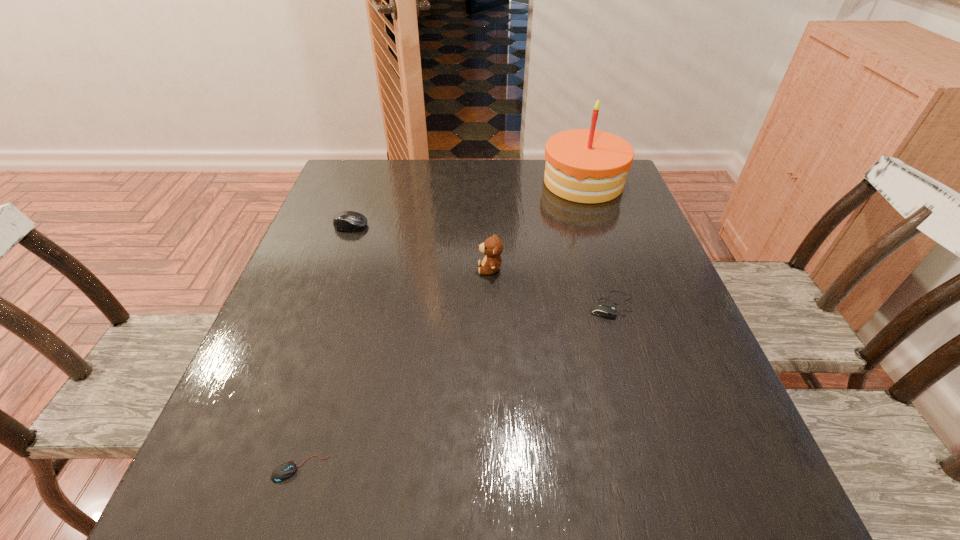
Where is `vacant space located on the left of the birthday cake`? This screenshot has width=960, height=540. vacant space located on the left of the birthday cake is located at coordinates (429, 182).

You are a GUI agent. You are given a task and a screenshot of the screen. Output one action in this format:
    pyautogui.click(x=<x>, y=<y>)
    Task: Click on the vacant space located 0.220m on the face of the teddy bear
    
    Given the screenshot: What is the action you would take?
    pyautogui.click(x=382, y=268)

Identify the location of vacant space located 0.360m on the face of the teddy bear. (321, 268).

Find the location of a particular element. vacant space situated 0.080m on the face of the teddy bear is located at coordinates (443, 268).

The width and height of the screenshot is (960, 540). Find the location of `blank space located 0.330m on the right of the tallest mouse`. blank space located 0.330m on the right of the tallest mouse is located at coordinates (496, 226).

This screenshot has width=960, height=540. Identify the location of vacant space situated 0.260m on the left of the second shortest object. (465, 305).

Where is `vacant space situated 0.350m on the right of the nearest mouse`? This screenshot has width=960, height=540. vacant space situated 0.350m on the right of the nearest mouse is located at coordinates (555, 469).

In order to click on object located at the far edge in this screenshot , I will do `click(589, 166)`.

You are a GUI agent. You are given a task and a screenshot of the screen. Output one action in this format:
    pyautogui.click(x=<x>, y=<y>)
    Task: Click on the object located in the near edge section of the desktop
    This screenshot has width=960, height=540.
    Given the screenshot: What is the action you would take?
    pyautogui.click(x=285, y=470)

This screenshot has width=960, height=540. What are the coordinates of `birthday cake present at the right edge` in the screenshot? It's located at (589, 166).